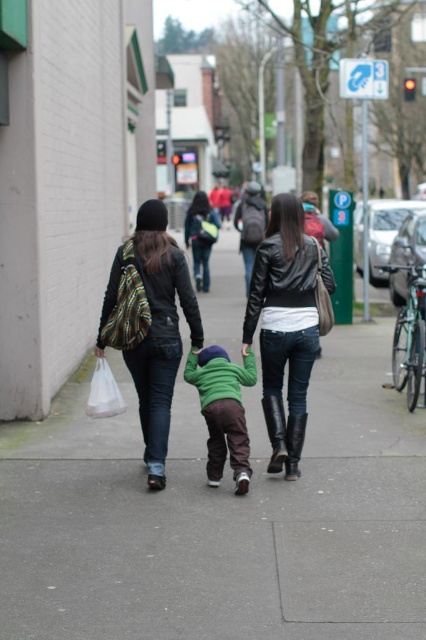
Question: Which point is farther to the camera?

Choices:
 (A) (359, 406)
 (B) (227, 374)
 (C) (97, 356)

Answer: (A)

Question: Is matte black jacket at center to the left of white plastic bag at lower left from the viewer's perspective?

Choices:
 (A) yes
 (B) no

Answer: (B)

Question: Can you confirm if green matte sweater at center is bigger than white plastic bag at lower left?

Choices:
 (A) yes
 (B) no

Answer: (A)

Question: Which of these objects is positioned closest to the green matte sweater at center?

Choices:
 (A) matte black jacket at center
 (B) white plastic bag at lower left
 (C) gray concrete sidewalk at center
 (D) leather jacket at center

Answer: (D)

Question: Can you confirm if gray concrete sidewalk at center is thinner than matte black jacket at left?

Choices:
 (A) no
 (B) yes

Answer: (A)

Question: Among these objects, which one is farthest from the camera?

Choices:
 (A) gray concrete sidewalk at center
 (B) leather jacket at center
 (C) white plastic bag at lower left

Answer: (C)